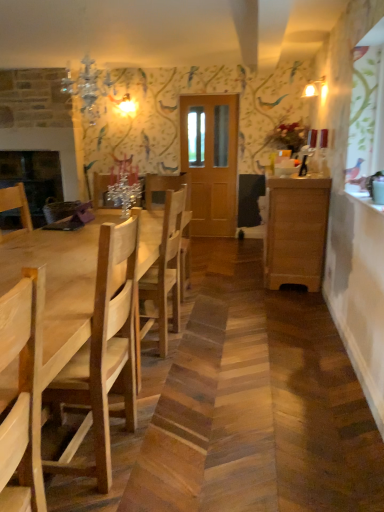
Question: Is light brown wooden table at left facing towards wooden cabinet at right?

Choices:
 (A) yes
 (B) no

Answer: (B)

Question: From the image's perspective, is light brown wooden table at left under wooden cabinet at right?

Choices:
 (A) no
 (B) yes

Answer: (B)

Question: Can you confirm if light brown wooden table at left is positioned to the left of wooden cabinet at right?

Choices:
 (A) no
 (B) yes

Answer: (B)

Question: Does light brown wooden table at left have a larger size compared to wooden cabinet at right?

Choices:
 (A) no
 (B) yes

Answer: (B)

Question: Is light brown wooden table at left positioned with its back to wooden cabinet at right?

Choices:
 (A) yes
 (B) no

Answer: (B)

Question: Based on their sizes in the image, would you say light brown wooden table at left is bigger or smaller than wooden cabinet at right?

Choices:
 (A) big
 (B) small

Answer: (A)

Question: From a real-world perspective, is light brown wooden table at left above or below wooden cabinet at right?

Choices:
 (A) above
 (B) below

Answer: (B)

Question: Looking at their shapes, would you say light brown wooden table at left is wider or thinner than wooden cabinet at right?

Choices:
 (A) thin
 (B) wide

Answer: (B)

Question: From the image's perspective, is light brown wooden table at left above or below wooden cabinet at right?

Choices:
 (A) below
 (B) above

Answer: (A)

Question: Is wooden cabinet at right to the left or to the right of light brown wooden table at left in the image?

Choices:
 (A) left
 (B) right

Answer: (B)

Question: Is wooden cabinet at right inside or outside of light brown wooden table at left?

Choices:
 (A) inside
 (B) outside

Answer: (B)

Question: In terms of width, does wooden cabinet at right look wider or thinner when compared to light brown wooden table at left?

Choices:
 (A) wide
 (B) thin

Answer: (B)

Question: Based on their sizes in the image, would you say wooden cabinet at right is bigger or smaller than light brown wooden table at left?

Choices:
 (A) small
 (B) big

Answer: (A)

Question: Based on their sizes in the image, would you say wooden cabinet at right is bigger or smaller than wooden chair at left, which appears as the 2th chair when viewed from the back?

Choices:
 (A) big
 (B) small

Answer: (A)

Question: From the image's perspective, relative to wooden chair at left, placed as the 1th chair when sorted from front to back, is wooden cabinet at right above or below?

Choices:
 (A) below
 (B) above

Answer: (B)